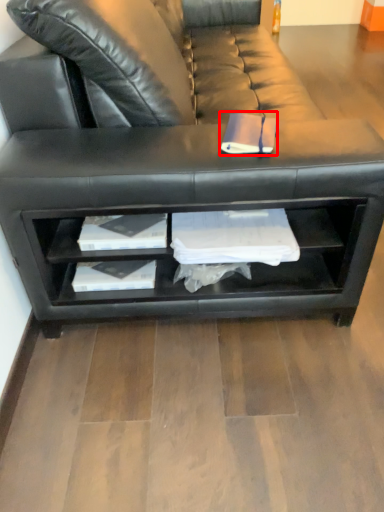
Question: Considering the relative positions of book (annotated by the red box) and studio couch in the image provided, where is book (annotated by the red box) located with respect to the staircase?

Choices:
 (A) left
 (B) right

Answer: (B)